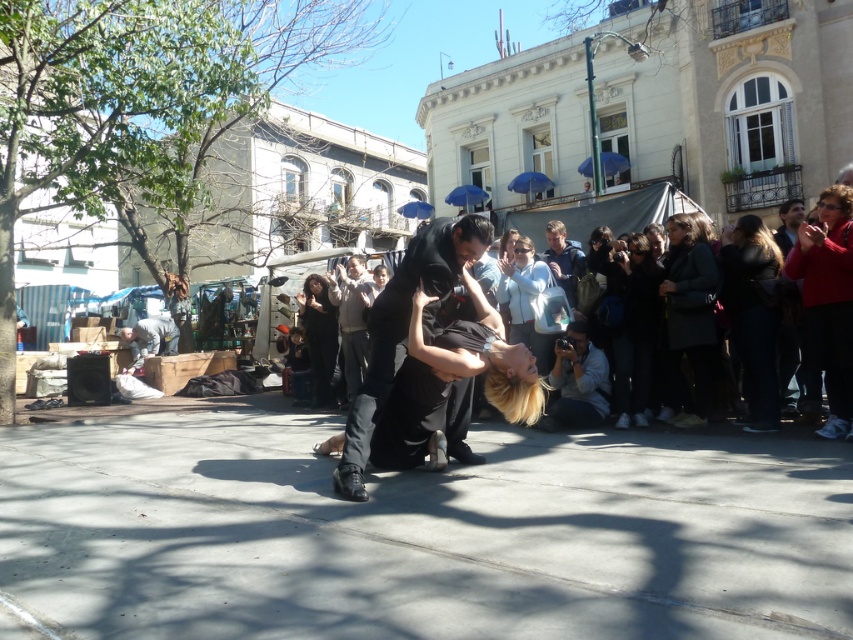
Does dark brown leather jacket at right have a lesser width compared to light brown leather jacket at upper center?

Incorrect, dark brown leather jacket at right's width is not less than light brown leather jacket at upper center's.

Does dark brown leather jacket at right have a larger size compared to light brown leather jacket at upper center?

Yes.

Which is in front, point (759, 330) or point (554, 262)?

Positioned in front is point (759, 330).

Where is `dark brown leather jacket at right`? dark brown leather jacket at right is located at coordinates (752, 316).

Between point (619, 369) and point (312, 380), which one is positioned behind?

The point (312, 380) is behind.

Where is `black fabric jacket at center`? The width and height of the screenshot is (853, 640). black fabric jacket at center is located at coordinates (635, 330).

Who is more forward, (677, 368) or (323, 358)?

Point (677, 368) is in front.

Does dark gray coat at right appear on the left side of matte black dress at center?

Incorrect, dark gray coat at right is not on the left side of matte black dress at center.

The width and height of the screenshot is (853, 640). What are the coordinates of `dark gray coat at right` in the screenshot? It's located at (689, 312).

What are the coordinates of `dark gray coat at right` in the screenshot? It's located at pyautogui.click(x=689, y=312).